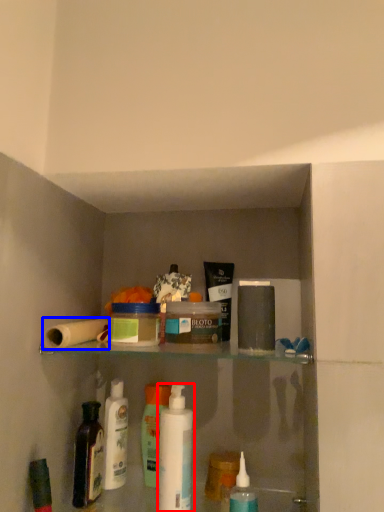
Question: Among these objects, which one is farthest to the camera, mouthwash (highlighted by a red box) or toilet paper (highlighted by a blue box)?

Choices:
 (A) mouthwash
 (B) toilet paper

Answer: (A)